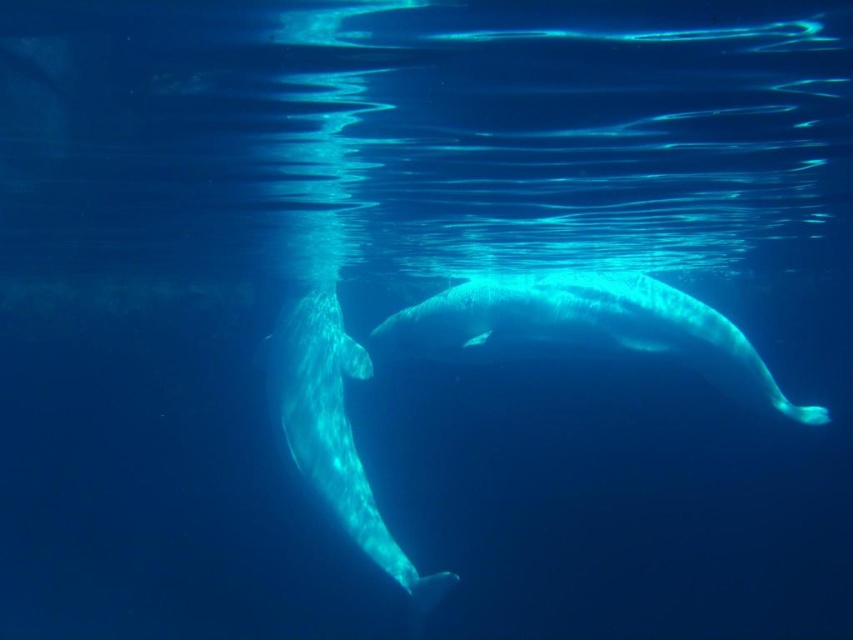
Find the location of `translucent blue whale at center`. translucent blue whale at center is located at coordinates (585, 328).

Is point (605, 328) closer to camera compared to point (334, 390)?

Yes, it is.

Between point (680, 326) and point (279, 353), which one is positioned in front?

Point (680, 326) is more forward.

Locate an element on the screen. translucent blue whale at center is located at coordinates (585, 328).